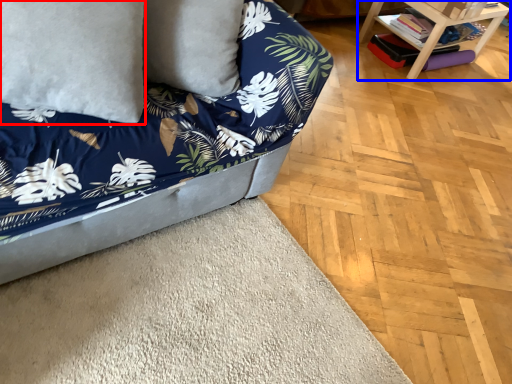
Question: Which object is closer to the camera taking this photo, pillow (highlighted by a red box) or table (highlighted by a blue box)?

Choices:
 (A) pillow
 (B) table

Answer: (A)